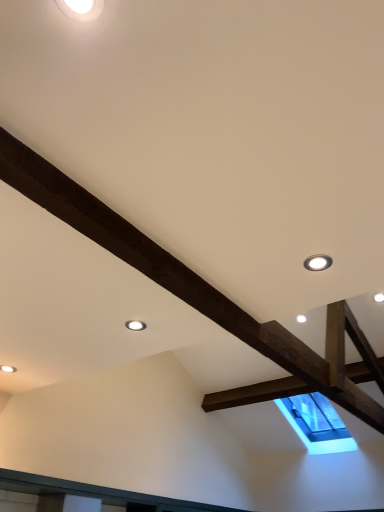
Where is `matte white droplight at upper right, the 3th droplight when ordered from left to right`? The image size is (384, 512). matte white droplight at upper right, the 3th droplight when ordered from left to right is located at coordinates click(318, 262).

In the scene shown: Measure the distance between matte white droplight at upper center, which ranks as the first droplight in back-to-front order, and camera.

The distance of matte white droplight at upper center, which ranks as the first droplight in back-to-front order, from camera is 1.93 meters.

The width and height of the screenshot is (384, 512). I want to click on white glossy droplight at upper left, which ranks as the 1th droplight in front-to-back order, so click(x=81, y=9).

Where is `droplight behind the matte white droplight at upper right, arranged as the second droplight when viewed from the top`? This screenshot has width=384, height=512. droplight behind the matte white droplight at upper right, arranged as the second droplight when viewed from the top is located at coordinates (135, 325).

Does matte white droplight at upper center, which ranks as the 3th droplight in right-to-left order, have a smaller size compared to matte white droplight at upper right, acting as the second droplight starting from the front?

Yes, matte white droplight at upper center, which ranks as the 3th droplight in right-to-left order, is smaller than matte white droplight at upper right, acting as the second droplight starting from the front.

Is matte white droplight at upper center, which ranks as the 3th droplight in right-to-left order, inside or outside of matte white droplight at upper right, acting as the 2th droplight starting from the back?

matte white droplight at upper center, which ranks as the 3th droplight in right-to-left order, exists outside the volume of matte white droplight at upper right, acting as the 2th droplight starting from the back.

Which object is closer to the camera taking this photo, matte white droplight at upper center, which is counted as the 1th droplight, starting from the left, or matte white droplight at upper right, acting as the 2th droplight starting from the back?

matte white droplight at upper right, acting as the 2th droplight starting from the back.

Does matte white droplight at upper center, which is counted as the 1th droplight, starting from the left, appear on the right side of white glossy droplight at upper left, which appears as the second droplight when viewed from the right?

No.

Is the surface of matte white droplight at upper center, which ranks as the first droplight in back-to-front order, in direct contact with white glossy droplight at upper left, which ranks as the 1th droplight in front-to-back order?

No, matte white droplight at upper center, which ranks as the first droplight in back-to-front order, is not in contact with white glossy droplight at upper left, which ranks as the 1th droplight in front-to-back order.

Is white glossy droplight at upper left, the third droplight ordered from the bottom, completely or partially inside matte white droplight at upper center, which is counted as the 1th droplight, starting from the left?

Definitely not — white glossy droplight at upper left, the third droplight ordered from the bottom, is not inside matte white droplight at upper center, which is counted as the 1th droplight, starting from the left.

Is matte white droplight at upper right, acting as the 2th droplight starting from the back, facing towards white glossy droplight at upper left, the third droplight viewed from the back?

No.

Could you measure the distance between matte white droplight at upper right, positioned as the second droplight in bottom-to-top order, and white glossy droplight at upper left, the third droplight ordered from the bottom?

The distance of matte white droplight at upper right, positioned as the second droplight in bottom-to-top order, from white glossy droplight at upper left, the third droplight ordered from the bottom, is 1.05 meters.

From a real-world perspective, is matte white droplight at upper right, acting as the second droplight starting from the front, physically below white glossy droplight at upper left, the third droplight ordered from the bottom?

Yes, from a real-world perspective, matte white droplight at upper right, acting as the second droplight starting from the front, is below white glossy droplight at upper left, the third droplight ordered from the bottom.

Is matte white droplight at upper right, acting as the 2th droplight starting from the back, completely or partially outside of white glossy droplight at upper left, positioned as the 2th droplight in left-to-right order?

Yes, matte white droplight at upper right, acting as the 2th droplight starting from the back, is outside of white glossy droplight at upper left, positioned as the 2th droplight in left-to-right order.

Measure the distance from white glossy droplight at upper left, which ranks as the 1th droplight in front-to-back order, to matte white droplight at upper right, positioned as the second droplight in bottom-to-top order.

They are 1.05 meters apart.

Locate an element on the screen. This screenshot has width=384, height=512. the 1st droplight to the left of the matte white droplight at upper right, which is counted as the first droplight, starting from the right, counting from the anchor's position is located at coordinates (81, 9).

Could matte white droplight at upper right, acting as the 2th droplight starting from the back, be considered to be inside white glossy droplight at upper left, placed as the 1th droplight when sorted from top to bottom?

No, matte white droplight at upper right, acting as the 2th droplight starting from the back, is located outside of white glossy droplight at upper left, placed as the 1th droplight when sorted from top to bottom.

Considering the sizes of objects white glossy droplight at upper left, placed as the 1th droplight when sorted from top to bottom, and matte white droplight at upper right, acting as the second droplight starting from the front, in the image provided, who is thinner, white glossy droplight at upper left, placed as the 1th droplight when sorted from top to bottom, or matte white droplight at upper right, acting as the second droplight starting from the front,?

With smaller width is white glossy droplight at upper left, placed as the 1th droplight when sorted from top to bottom.

In terms of height, does matte white droplight at upper right, acting as the second droplight starting from the front, look taller or shorter compared to matte white droplight at upper center, the 3th droplight when ordered from top to bottom?

matte white droplight at upper right, acting as the second droplight starting from the front, is taller than matte white droplight at upper center, the 3th droplight when ordered from top to bottom.

Is matte white droplight at upper right, arranged as the second droplight when viewed from the top, not inside matte white droplight at upper center, positioned as the 3th droplight in front-to-back order?

Yes, matte white droplight at upper right, arranged as the second droplight when viewed from the top, is outside of matte white droplight at upper center, positioned as the 3th droplight in front-to-back order.

Is matte white droplight at upper right, the 3th droplight when ordered from left to right, oriented away from matte white droplight at upper center, the 3th droplight when ordered from top to bottom?

matte white droplight at upper right, the 3th droplight when ordered from left to right, is not turned away from matte white droplight at upper center, the 3th droplight when ordered from top to bottom.

Is point (73, 15) farther from camera compared to point (127, 321)?

No.

From a real-world perspective, does white glossy droplight at upper left, positioned as the 2th droplight in left-to-right order, stand above matte white droplight at upper center, which ranks as the 3th droplight in right-to-left order?

Indeed, from a real-world perspective, white glossy droplight at upper left, positioned as the 2th droplight in left-to-right order, stands above matte white droplight at upper center, which ranks as the 3th droplight in right-to-left order.

Looking at their sizes, would you say white glossy droplight at upper left, placed as the 1th droplight when sorted from top to bottom, is wider or thinner than matte white droplight at upper center, the 3th droplight when ordered from top to bottom?

white glossy droplight at upper left, placed as the 1th droplight when sorted from top to bottom, is thinner than matte white droplight at upper center, the 3th droplight when ordered from top to bottom.

The image size is (384, 512). What are the coordinates of `droplight that is the 1st one above the matte white droplight at upper center, which is counted as the 1th droplight, starting from the left (from a real-world perspective)` in the screenshot? It's located at (318, 262).

Find the location of a particular element. The width and height of the screenshot is (384, 512). the 2nd droplight behind the white glossy droplight at upper left, which appears as the second droplight when viewed from the right is located at coordinates (135, 325).

From the image, which object appears to be farther from matte white droplight at upper center, which ranks as the first droplight in back-to-front order, white glossy droplight at upper left, placed as the 1th droplight when sorted from top to bottom, or matte white droplight at upper right, acting as the 2th droplight starting from the back?

white glossy droplight at upper left, placed as the 1th droplight when sorted from top to bottom, is positioned further to the anchor matte white droplight at upper center, which ranks as the first droplight in back-to-front order.

Looking at the image, which one is located further to matte white droplight at upper right, which is counted as the first droplight, starting from the right, white glossy droplight at upper left, the third droplight viewed from the back, or matte white droplight at upper center, which ranks as the 3th droplight in right-to-left order?

white glossy droplight at upper left, the third droplight viewed from the back.

Based on their spatial positions, is matte white droplight at upper center, positioned as the 3th droplight in front-to-back order, or matte white droplight at upper right, which is counted as the first droplight, starting from the right, further from white glossy droplight at upper left, which ranks as the 1th droplight in front-to-back order?

matte white droplight at upper center, positioned as the 3th droplight in front-to-back order, is positioned further to the anchor white glossy droplight at upper left, which ranks as the 1th droplight in front-to-back order.

Based on the photo, based on their spatial positions, is matte white droplight at upper right, acting as the 2th droplight starting from the back, or white glossy droplight at upper left, which ranks as the 1th droplight in front-to-back order, further from matte white droplight at upper center, the 3th droplight when ordered from top to bottom?

white glossy droplight at upper left, which ranks as the 1th droplight in front-to-back order.

Looking at the image, which one is located closer to white glossy droplight at upper left, the third droplight ordered from the bottom, matte white droplight at upper right, arranged as the second droplight when viewed from the top, or matte white droplight at upper center, which ranks as the first droplight in back-to-front order?

matte white droplight at upper right, arranged as the second droplight when viewed from the top, is closer to white glossy droplight at upper left, the third droplight ordered from the bottom.

When comparing their distances from matte white droplight at upper right, which is counted as the first droplight, starting from the right, does matte white droplight at upper center, the first droplight from the bottom, or white glossy droplight at upper left, placed as the 1th droplight when sorted from top to bottom, seem further?

Based on the image, white glossy droplight at upper left, placed as the 1th droplight when sorted from top to bottom, appears to be further to matte white droplight at upper right, which is counted as the first droplight, starting from the right.

Find the location of `droplight between white glossy droplight at upper left, placed as the 1th droplight when sorted from top to bottom, and matte white droplight at upper center, which ranks as the first droplight in back-to-front order, from front to back`. droplight between white glossy droplight at upper left, placed as the 1th droplight when sorted from top to bottom, and matte white droplight at upper center, which ranks as the first droplight in back-to-front order, from front to back is located at coordinates (318, 262).